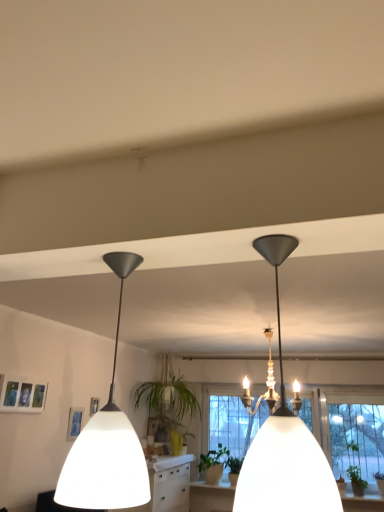
Question: Considering the relative sizes of green leafy plant at lower right, marked as the second plant in a back-to-front arrangement, and green matte plant at center, the 1th plant when ordered from left to right, in the image provided, is green leafy plant at lower right, marked as the second plant in a back-to-front arrangement, bigger than green matte plant at center, the 1th plant when ordered from left to right,?

Choices:
 (A) no
 (B) yes

Answer: (B)

Question: Is green leafy plant at lower right, positioned as the first plant in right-to-left order, not within green matte plant at center, the 1th plant when ordered from left to right?

Choices:
 (A) no
 (B) yes

Answer: (B)

Question: Considering the relative positions of green leafy plant at lower right, the 1th plant when ordered from front to back, and green matte plant at center, the 1th plant when ordered from left to right, in the image provided, is green leafy plant at lower right, the 1th plant when ordered from front to back, in front of green matte plant at center, the 1th plant when ordered from left to right,?

Choices:
 (A) no
 (B) yes

Answer: (B)

Question: Does green leafy plant at lower right, positioned as the first plant in right-to-left order, have a lesser width compared to green matte plant at center, marked as the 2th plant in a right-to-left arrangement?

Choices:
 (A) no
 (B) yes

Answer: (A)

Question: Considering the relative sizes of green leafy plant at lower right, the 2th plant in the left-to-right sequence, and green matte plant at center, marked as the 2th plant in a right-to-left arrangement, in the image provided, is green leafy plant at lower right, the 2th plant in the left-to-right sequence, shorter than green matte plant at center, marked as the 2th plant in a right-to-left arrangement,?

Choices:
 (A) no
 (B) yes

Answer: (A)

Question: From the image's perspective, is green leafy plant at lower right, positioned as the first plant in right-to-left order, below green matte plant at center, the 1th plant when ordered from left to right?

Choices:
 (A) yes
 (B) no

Answer: (B)

Question: Can you confirm if green leafy plant at center is shorter than green matte plant at center, the 1th plant from the back?

Choices:
 (A) no
 (B) yes

Answer: (A)

Question: Is green leafy plant at center to the left of green matte plant at center, the 2th plant positioned from the front, from the viewer's perspective?

Choices:
 (A) yes
 (B) no

Answer: (A)

Question: Would you say green leafy plant at center is a long distance from green matte plant at center, the 1th plant when ordered from left to right?

Choices:
 (A) yes
 (B) no

Answer: (B)

Question: Does green leafy plant at center have a greater width compared to green matte plant at center, the 1th plant from the back?

Choices:
 (A) no
 (B) yes

Answer: (B)

Question: Is green leafy plant at center positioned beyond the bounds of green matte plant at center, marked as the 2th plant in a right-to-left arrangement?

Choices:
 (A) no
 (B) yes

Answer: (B)

Question: From the image's perspective, is green leafy plant at center under green matte plant at center, the 1th plant when ordered from left to right?

Choices:
 (A) no
 (B) yes

Answer: (A)

Question: Is white matte lampshade at center, placed as the second lamp when sorted from left to right, touching green leafy plant at lower right, positioned as the first plant in right-to-left order?

Choices:
 (A) no
 (B) yes

Answer: (A)